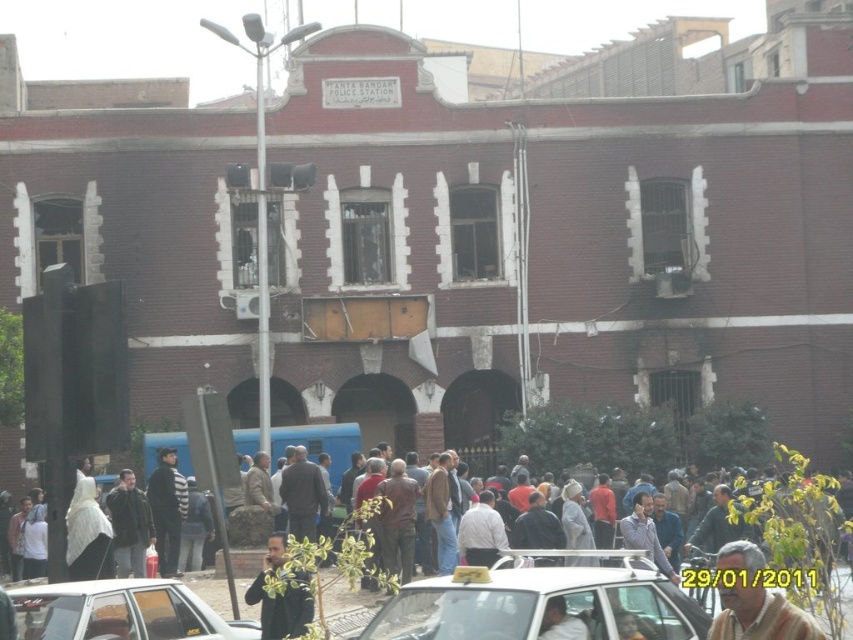
You are standing in front of the FANTA BANDAR building and notice a striped fabric jacket at center. Where exactly is this jacket positioned relative to the building entrance?

The striped fabric jacket at center is located at point (194, 529), which places it near the entrance area of the building.

In the scene shown: You are standing in front of the FANTA BANDAR building and notice two people wearing a striped fabric shirt at center and a dark brown leather jacket at center. Which clothing item is positioned lower on their bodies?

The striped fabric shirt at center is located below the dark brown leather jacket at center, so the striped fabric shirt at center is positioned lower on their bodies.